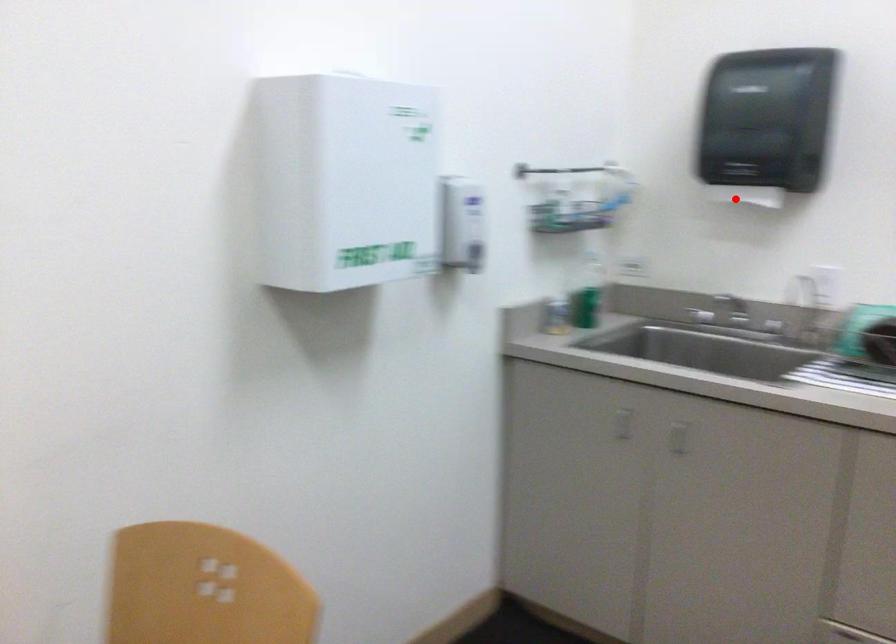
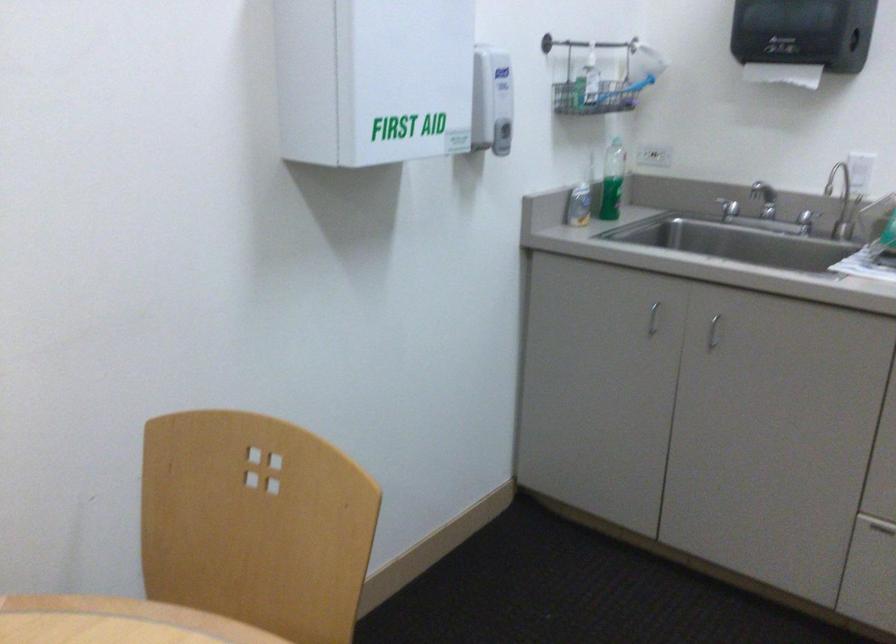
Question: I am providing you with two images of the same scene from different viewpoints. A red point is shown in image1. For the corresponding object point in image2, is it positioned nearer or farther from the camera?

Choices:
 (A) Nearer
 (B) Farther

Answer: (A)